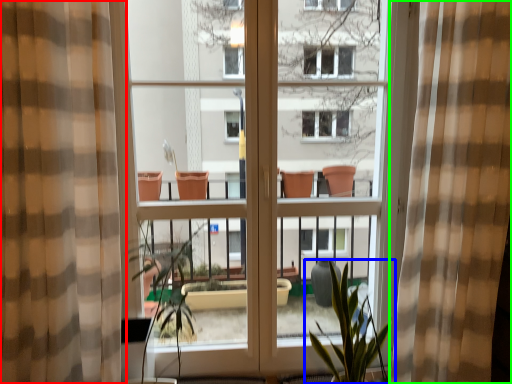
Question: Based on their relative distances, which object is farther from curtain (highlighted by a red box)? Choose from houseplant (highlighted by a blue box) and curtain (highlighted by a green box).

Choices:
 (A) houseplant
 (B) curtain

Answer: (B)